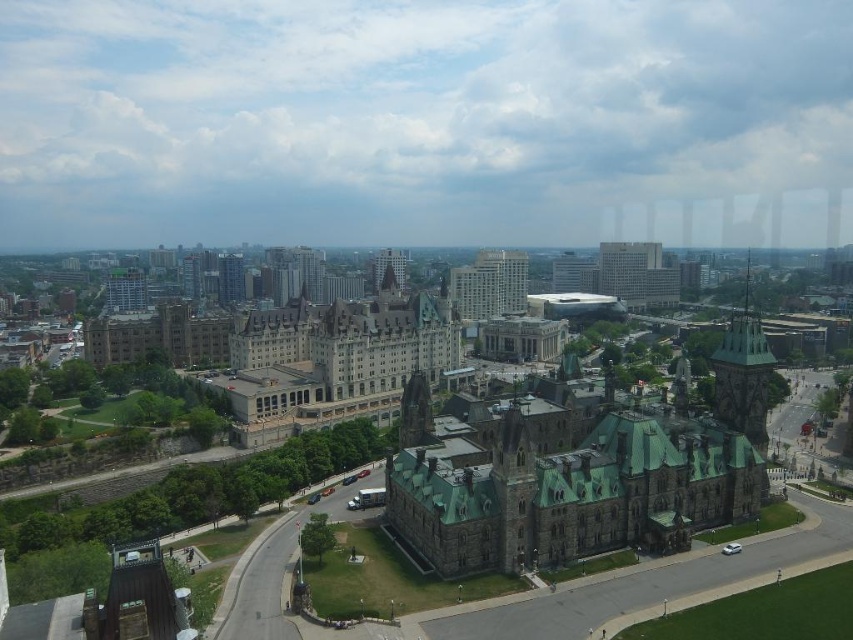
Between brown stone tower at upper right and glassy blue skyscraper at center-left, which one is positioned lower?

Positioned lower is brown stone tower at upper right.

Is brown stone tower at upper right positioned at the back of glassy blue skyscraper at center-left?

No, brown stone tower at upper right is closer to the viewer.

Between point (730, 346) and point (218, 268), which one is positioned behind?

Point (218, 268)

Where is `brown stone tower at upper right`? The height and width of the screenshot is (640, 853). brown stone tower at upper right is located at coordinates (743, 374).

Between point (242, 289) and point (397, 256), which one is positioned behind?

Point (242, 289)

This screenshot has width=853, height=640. What do you see at coordinates (230, 278) in the screenshot?
I see `glassy blue skyscraper at center-left` at bounding box center [230, 278].

Between point (227, 253) and point (401, 280), which one is positioned behind?

Point (227, 253)

This screenshot has width=853, height=640. I want to click on glassy blue skyscraper at center-left, so click(230, 278).

Describe the element at coordinates (743, 374) in the screenshot. I see `brown stone tower at upper right` at that location.

Between point (718, 348) and point (401, 264), which one is positioned in front?

Point (718, 348) is more forward.

Does point (714, 408) lie behind point (403, 268)?

No, it is in front of (403, 268).

Identify the location of brown stone tower at upper right. The image size is (853, 640). (743, 374).